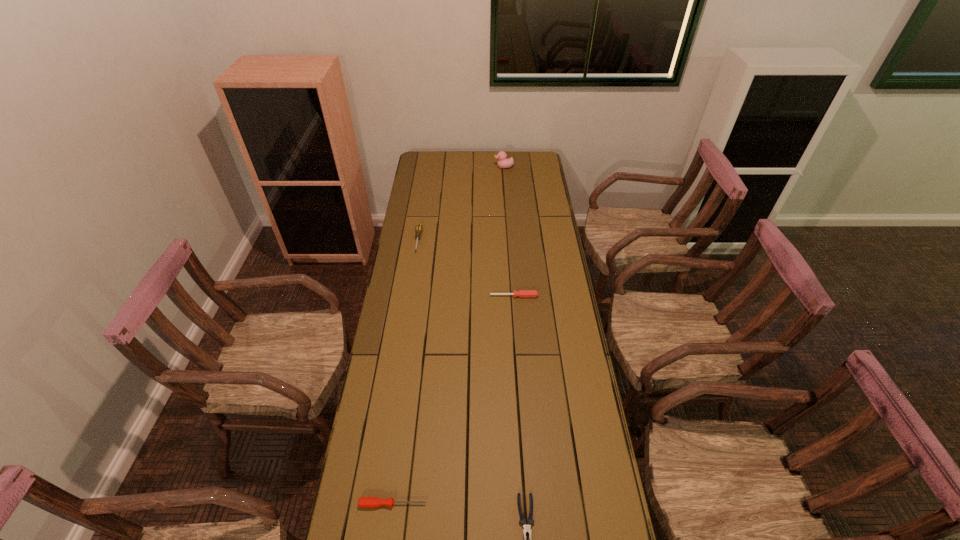
Where is `screwdriver that stands as the second closest to the second tallest screwdriver`? This screenshot has width=960, height=540. screwdriver that stands as the second closest to the second tallest screwdriver is located at coordinates (364, 502).

This screenshot has height=540, width=960. I want to click on screwdriver identified as the second closest to the second tallest screwdriver, so click(x=364, y=502).

Locate an element on the screen. vacant point that satisfies the following two spatial constraints: 1. on the back side of the rightmost screwdriver; 2. on the front-facing side of the duckling is located at coordinates (505, 167).

I want to click on vacant space that satisfies the following two spatial constraints: 1. on the front-facing side of the rightmost screwdriver; 2. on the right side of the tallest object, so [514, 296].

At what (x,y) coordinates should I click in order to perform the action: click on free space that satisfies the following two spatial constraints: 1. on the front-facing side of the duckling; 2. at the tip of the second farthest object. Please return your answer as a coordinate pair (x, y). Looking at the image, I should click on (509, 240).

Find the location of a particular element. The width and height of the screenshot is (960, 540). free location that satisfies the following two spatial constraints: 1. on the front-facing side of the farthest object; 2. at the tip of the tallest screwdriver is located at coordinates (509, 240).

Locate an element on the screen. free spot that satisfies the following two spatial constraints: 1. on the front-facing side of the tallest object; 2. at the tip of the tallest screwdriver is located at coordinates (509, 240).

The height and width of the screenshot is (540, 960). What are the coordinates of `vacant area that satisfies the following two spatial constraints: 1. on the front-facing side of the tallest object; 2. on the left side of the rightmost screwdriver` in the screenshot? It's located at (514, 296).